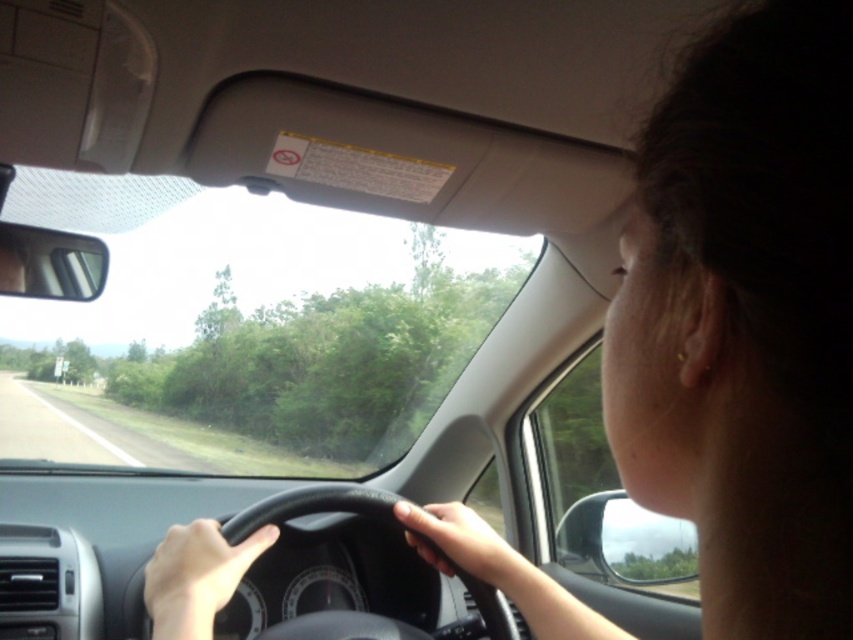
You are a passenger in the car and want to reach the smooth skin hand at lower left from the black leather steering wheel at center. Which direction should you move your hand to reach it?

The smooth skin hand at lower left is closer to you than the black leather steering wheel at center. To reach it, move your hand toward yourself.

You are a passenger in the car and want to check the driver. Which object is closer to the center of the car, the black leather steering wheel at center or the smooth skin hand at center?

The black leather steering wheel at center is to the left of the smooth skin hand at center, so the steering wheel is closer to the center of the car.

You are a passenger in the car and want to know if you can comfortably rest your hand on the steering wheel without touching the other hand. Based on the scene, can you tell if there is enough space between the black leather steering wheel at center and the smooth skin hand at center?

The black leather steering wheel at center is bigger than the smooth skin hand at center, so there is enough space between them for you to rest your hand comfortably without touching the other hand.